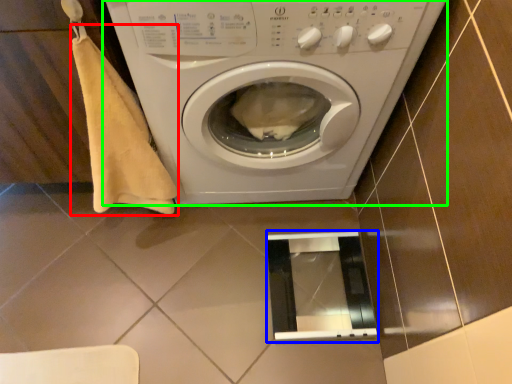
Question: Considering the real-world distances, which object is farthest from blanket (highlighted by a red box)? screen door (highlighted by a blue box) or washing machine (highlighted by a green box)?

Choices:
 (A) screen door
 (B) washing machine

Answer: (A)